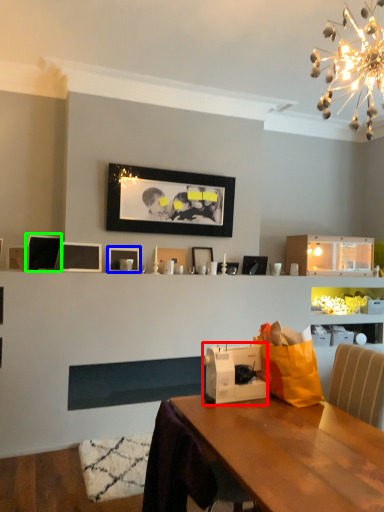
Question: Which object is the closest to the appliance (highlighted by a red box)? Choose among these: picture frame (highlighted by a blue box) or picture frame (highlighted by a green box).

Choices:
 (A) picture frame
 (B) picture frame

Answer: (A)